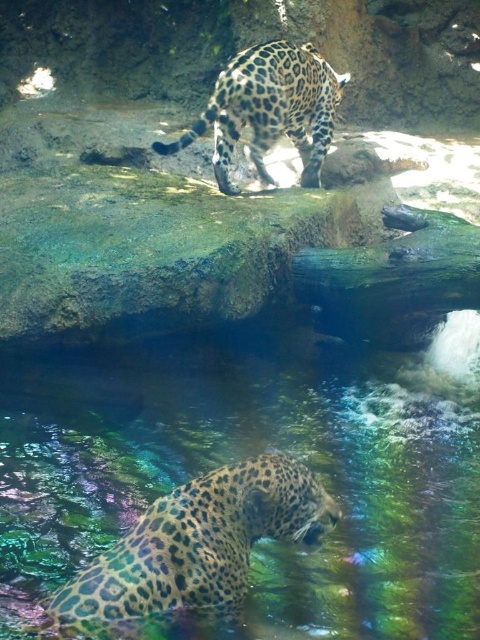
You are a zookeeper observing the jaguars in their enclosure. You notice the translucent glass water at center and the spotted fur jaguar at lower left. Which object is higher in the image?

The translucent glass water at center is taller than the spotted fur jaguar at lower left.

You are a zookeeper who needs to ensure the jaguars have enough space between them for safety. The safety guideline requires at least 5 feet of distance between the jaguars. Based on the scene, is the distance between the translucent glass water at center and the spotted fur jaguar at upper center sufficient?

The translucent glass water at center is 6.64 feet away from the spotted fur jaguar at upper center, which exceeds the required 5 feet safety distance. Therefore, the distance is sufficient.